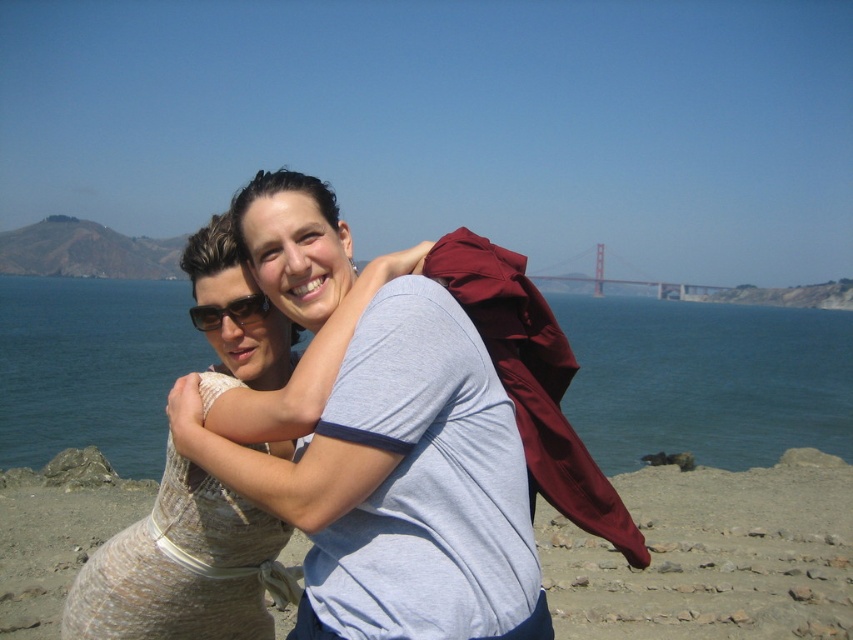
Does point (457, 506) lie behind point (595, 380)?

No, it is in front of (595, 380).

Is light beige textured dress at center above blue water at center?

Actually, light beige textured dress at center is below blue water at center.

Is point (277, 305) less distant than point (9, 339)?

Yes.

Image resolution: width=853 pixels, height=640 pixels. Find the location of `light beige textured dress at center`. light beige textured dress at center is located at coordinates (401, 484).

Who is positioned more to the right, smooth sand at center or beige textured dress at center?

smooth sand at center

Is point (15, 561) less distant than point (258, 372)?

No, (15, 561) is further to viewer.

Find the location of a particular element. The image size is (853, 640). smooth sand at center is located at coordinates (712, 556).

Does light beige textured dress at center appear on the right side of metallic bridge at center?

No, light beige textured dress at center is not to the right of metallic bridge at center.

Is light beige textured dress at center closer to the viewer compared to metallic bridge at center?

Yes, light beige textured dress at center is in front of metallic bridge at center.

Which is in front, point (421, 432) or point (683, 285)?

Point (421, 432)

I want to click on light beige textured dress at center, so click(x=401, y=484).